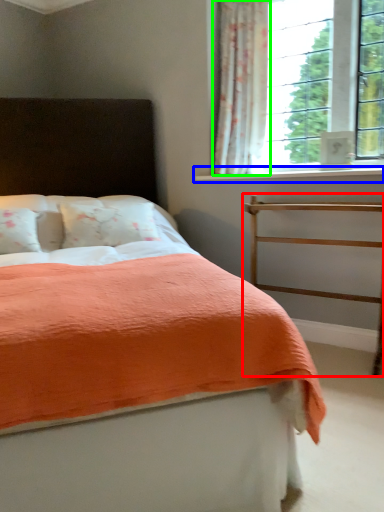
Question: Considering the real-world distances, which object is farthest from balustrade (highlighted by a red box)? window sill (highlighted by a blue box) or curtain (highlighted by a green box)?

Choices:
 (A) window sill
 (B) curtain

Answer: (B)